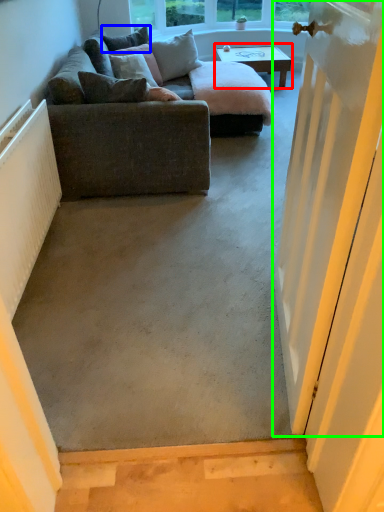
Question: Which object is the farthest from coffee table (highlighted by a red box)? Choose among these: pillow (highlighted by a blue box) or door (highlighted by a green box).

Choices:
 (A) pillow
 (B) door

Answer: (B)